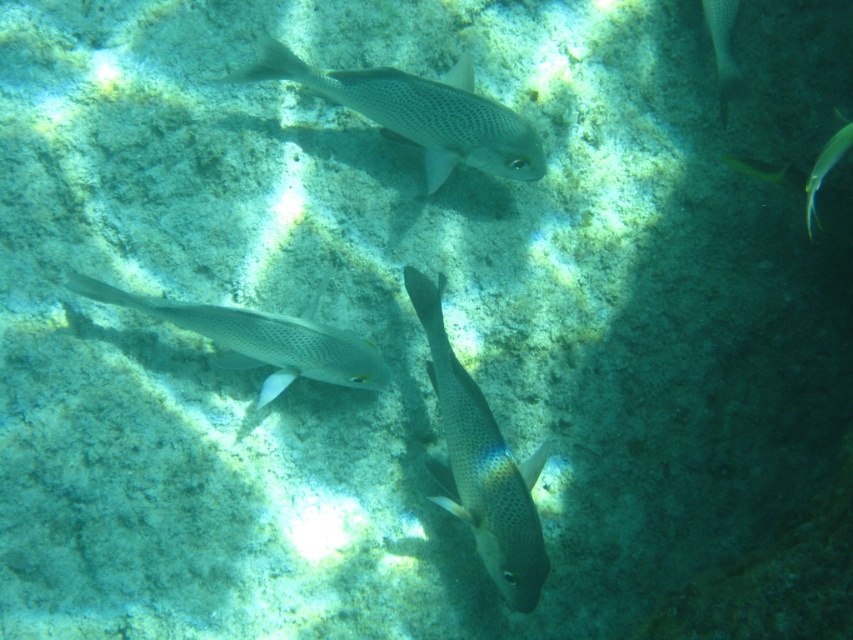
Which is behind, point (433, 465) or point (257, 65)?

The point (257, 65) is more distant.

Who is more forward, (489, 467) or (326, 81)?

Point (489, 467)

The height and width of the screenshot is (640, 853). I want to click on shiny silver fish at center, so click(480, 464).

Does shiny silver fish at center have a larger size compared to shiny silver fish at right?

Yes.

Which of these two, shiny silver fish at center or shiny silver fish at right, stands shorter?

shiny silver fish at right

Does point (508, 540) lie behind point (851, 138)?

No, it is in front of (851, 138).

The height and width of the screenshot is (640, 853). Identify the location of shiny silver fish at center. (480, 464).

Where is `speckled silver fish at upper center`? The width and height of the screenshot is (853, 640). speckled silver fish at upper center is located at coordinates (419, 113).

Which is below, speckled silver fish at upper center or shiny yellow fish at upper right?

shiny yellow fish at upper right

This screenshot has height=640, width=853. In order to click on speckled silver fish at upper center in this screenshot , I will do `click(419, 113)`.